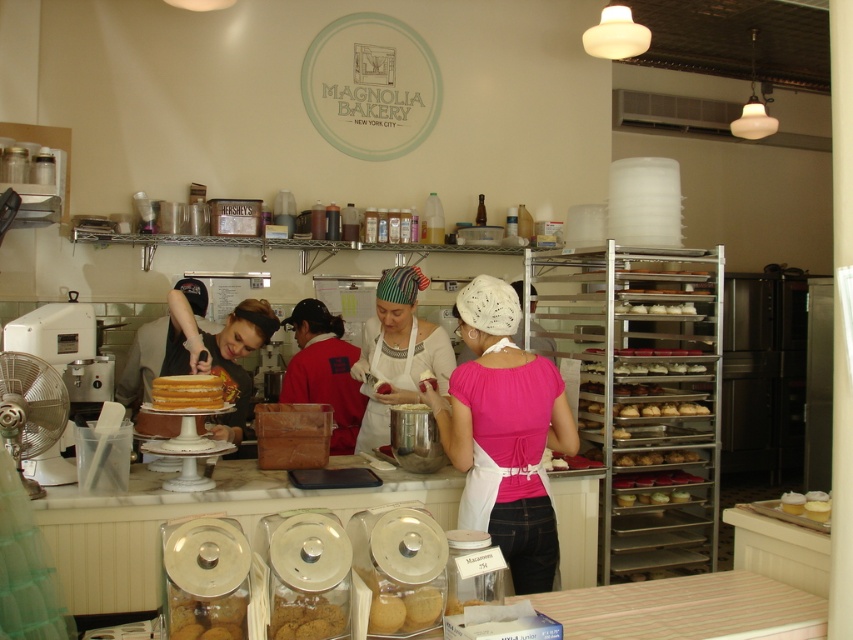
Does striped fabric headscarf at center appear over red fabric apron at center?

Yes, striped fabric headscarf at center is above red fabric apron at center.

Does striped fabric headscarf at center lie behind red fabric apron at center?

No.

At what (x,y) coordinates should I click in order to perform the action: click on striped fabric headscarf at center. Please return your answer as a coordinate pair (x, y). The width and height of the screenshot is (853, 640). Looking at the image, I should click on (398, 353).

Is pink satin blouse at center below striped fabric headscarf at center?

Yes, pink satin blouse at center is below striped fabric headscarf at center.

Which is in front, point (496, 294) or point (383, 416)?

Point (496, 294) is more forward.

Find the location of a particular element. The width and height of the screenshot is (853, 640). pink satin blouse at center is located at coordinates (503, 433).

Is striped fabric headscarf at center positioned at the back of matte black cake at center?

Yes, striped fabric headscarf at center is behind matte black cake at center.

Who is lower down, striped fabric headscarf at center or matte black cake at center?

striped fabric headscarf at center

Is point (386, 321) farther from camera compared to point (173, 330)?

No, it is in front of (173, 330).

Where is `striped fabric headscarf at center`? The image size is (853, 640). striped fabric headscarf at center is located at coordinates (398, 353).